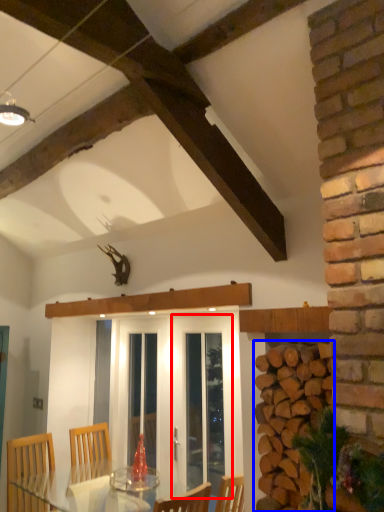
Question: Among these objects, which one is nearest to the camera, screen door (highlighted by a red box) or brickwork (highlighted by a blue box)?

Choices:
 (A) screen door
 (B) brickwork

Answer: (B)